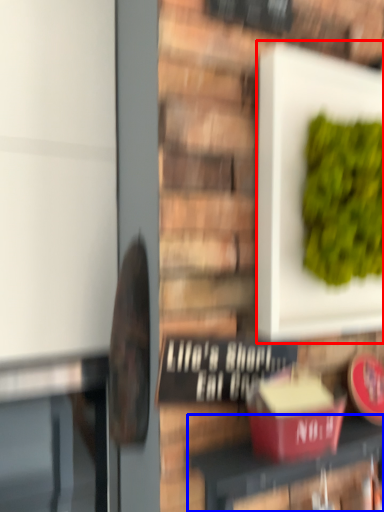
Question: Which object is further to the camera taking this photo, square (highlighted by a red box) or furniture (highlighted by a blue box)?

Choices:
 (A) square
 (B) furniture

Answer: (A)